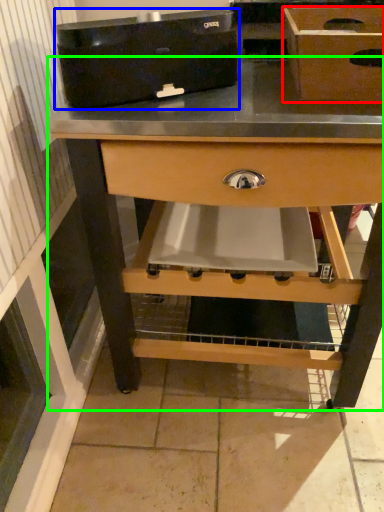
Question: Considering the real-world distances, which object is closest to box (highlighted by a red box)? appliance (highlighted by a blue box) or table (highlighted by a green box).

Choices:
 (A) appliance
 (B) table

Answer: (A)